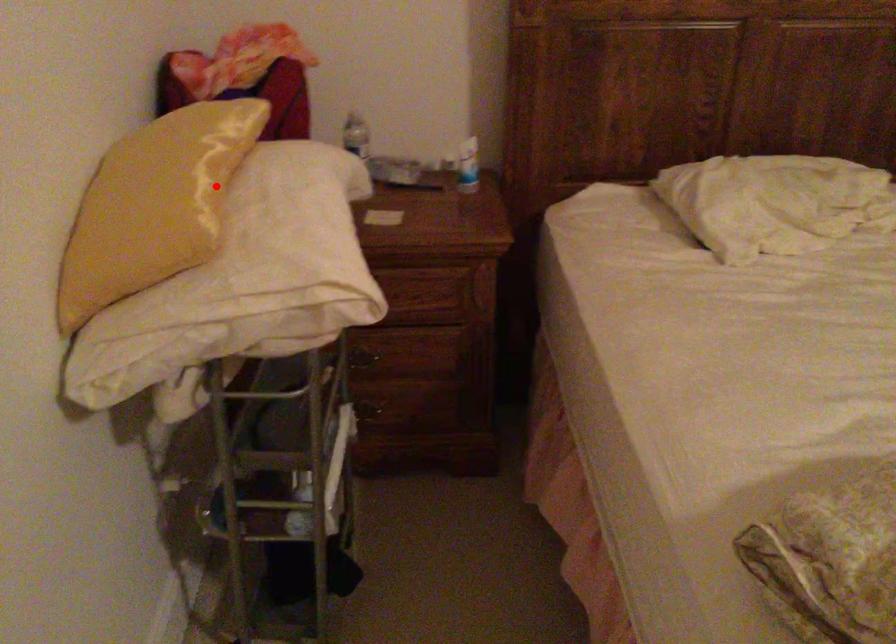
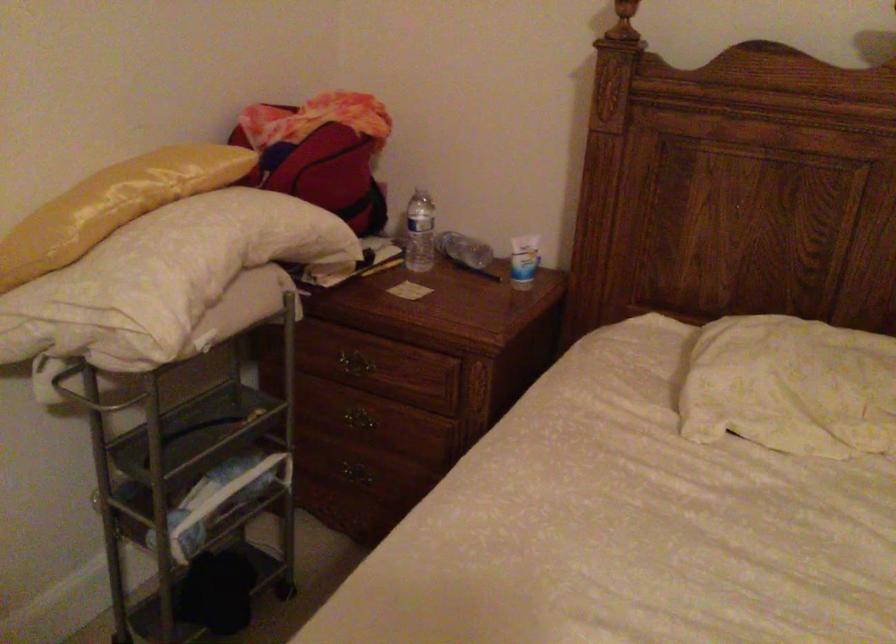
Question: I am providing you with two images of the same scene from different viewpoints. Given a red point in image1, look at the same physical point in image2. Is it:

Choices:
 (A) Closer to the viewpoint
 (B) Farther from the viewpoint

Answer: (B)